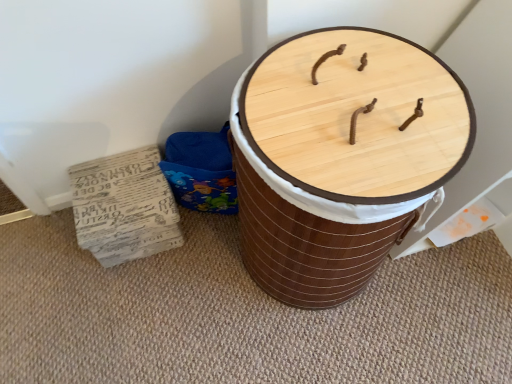
Where is `free spot above recycled paper stack at lower left (from a real-world perspective)`? Image resolution: width=512 pixels, height=384 pixels. free spot above recycled paper stack at lower left (from a real-world perspective) is located at coordinates (117, 193).